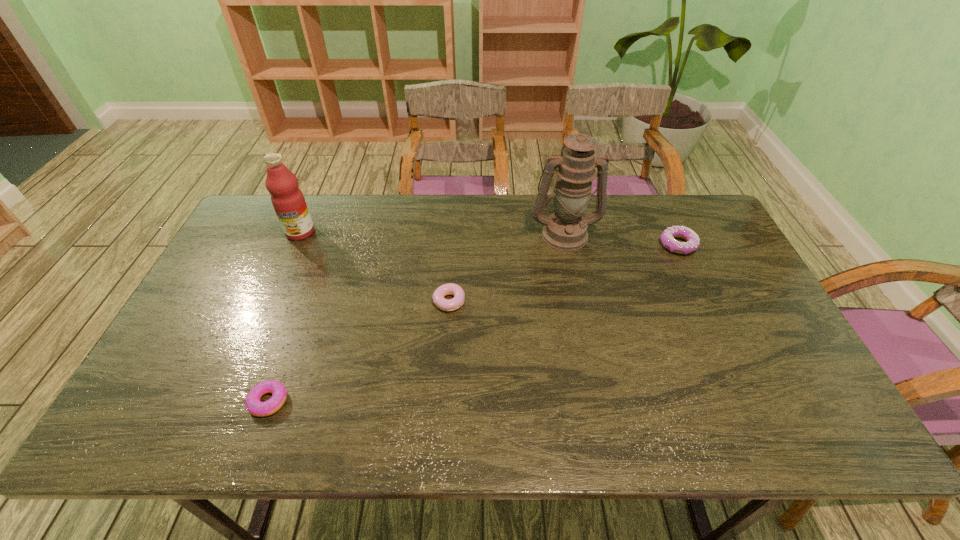
I want to click on doughnut that can be found as the closest to the leftmost object, so click(453, 289).

Identify the location of blank space that satisfies the following two spatial constraints: 1. on the label of the oil lamp; 2. on the left side of the second tallest object. (300, 234).

At what (x,y) coordinates should I click in order to perform the action: click on free space that satisfies the following two spatial constraints: 1. on the label of the second nearest object; 2. on the left side of the fourth shortest object. Please return your answer as a coordinate pair (x, y). Image resolution: width=960 pixels, height=540 pixels. Looking at the image, I should click on (270, 301).

Find the location of a particular element. The image size is (960, 540). vacant space that satisfies the following two spatial constraints: 1. on the label of the second tallest object; 2. on the left side of the shortest object is located at coordinates click(x=227, y=401).

At what (x,y) coordinates should I click in order to perform the action: click on vacant region that satisfies the following two spatial constraints: 1. on the label of the fourth object from right to left; 2. on the right side of the fourth shortest object. Please return your answer as a coordinate pair (x, y). Looking at the image, I should click on (227, 401).

Image resolution: width=960 pixels, height=540 pixels. In order to click on vacant point that satisfies the following two spatial constraints: 1. on the label of the fruit juice; 2. on the left side of the nearest doughnut in this screenshot , I will do `click(227, 401)`.

Where is `free spot that satisfies the following two spatial constraints: 1. on the label of the leftmost object; 2. on the left side of the shortest doughnut`? The height and width of the screenshot is (540, 960). free spot that satisfies the following two spatial constraints: 1. on the label of the leftmost object; 2. on the left side of the shortest doughnut is located at coordinates (227, 401).

The height and width of the screenshot is (540, 960). I want to click on free space that satisfies the following two spatial constraints: 1. on the label of the farthest doughnut; 2. on the left side of the leftmost object, so click(x=295, y=245).